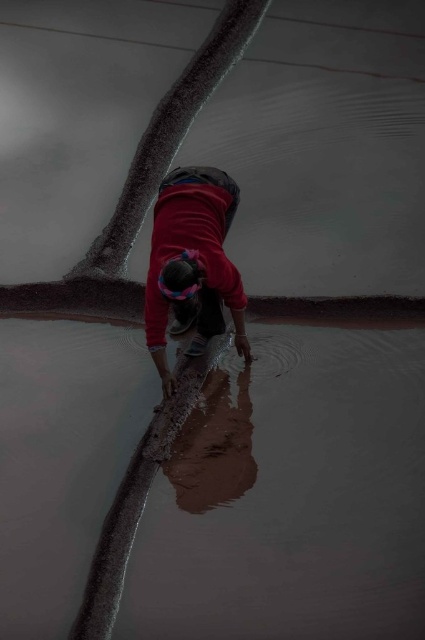
What is the exact coordinate of the brown clay flood at lower center?

The brown clay flood at lower center is located at point (291, 497).

You are a photographer trying to capture the red fabric person at center and the brown clay flood at lower center in the same frame. Based on their positions, which object should you adjust your camera to focus on first to ensure both are in the frame?

The red fabric person at center is closer to the camera than the brown clay flood at lower center, so you should focus on the red fabric person at center first to ensure both are in the frame.